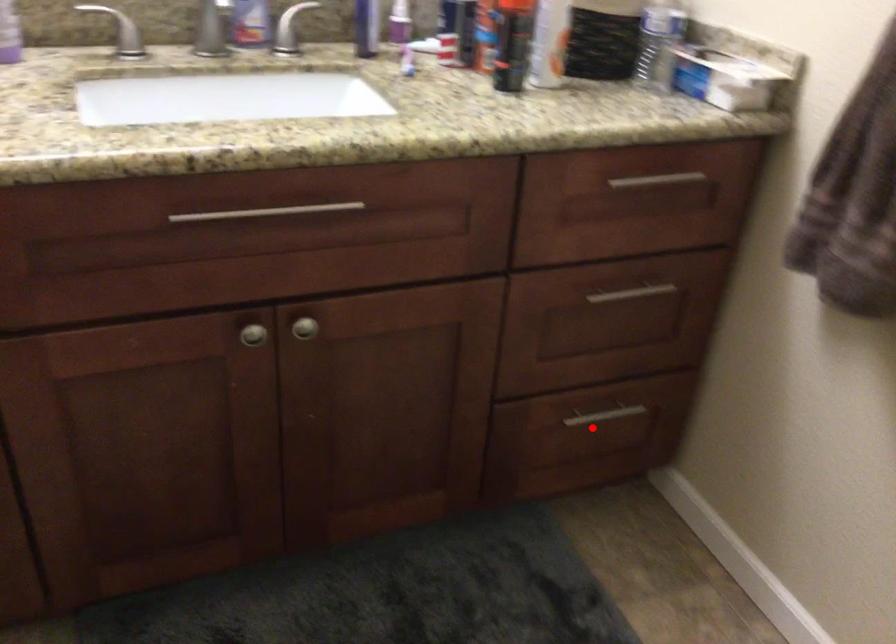
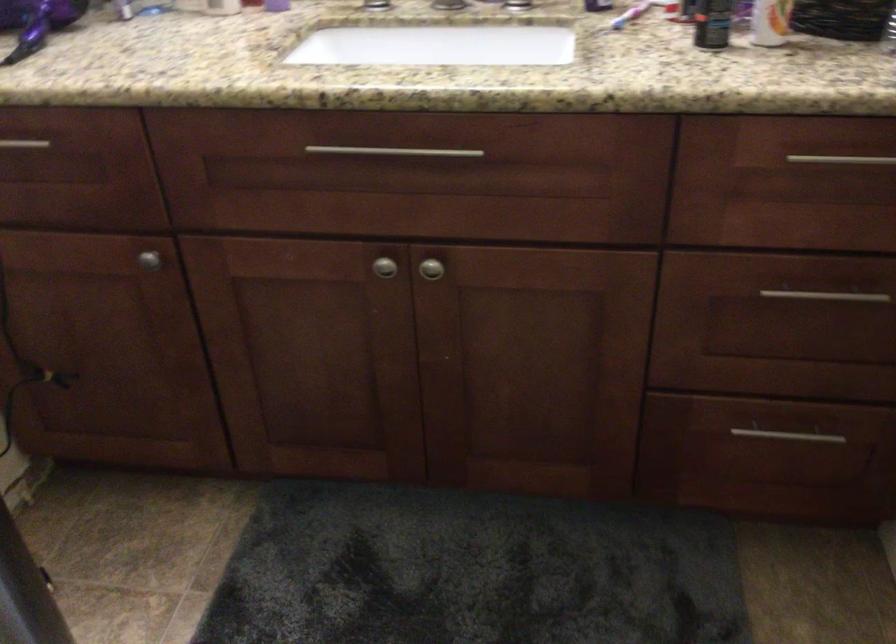
Question: I am providing you with two images of the same scene from different viewpoints. In image1, a red point is highlighted. Considering the same 3D point in image2, which of the following is correct?

Choices:
 (A) It is closer
 (B) It is farther

Answer: (A)